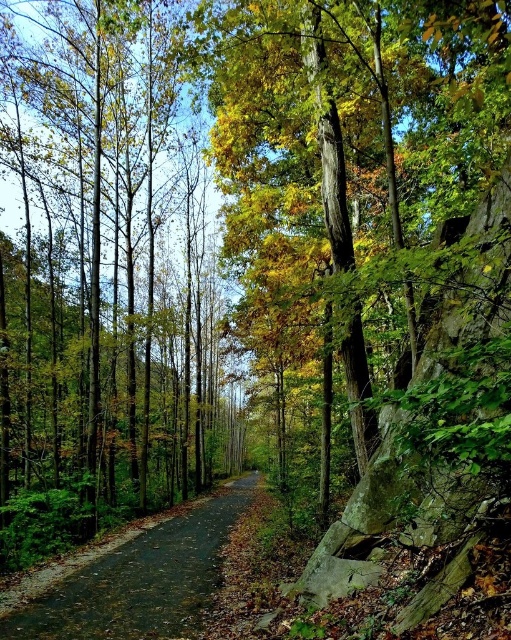
Question: Among these objects, which one is nearest to the camera?

Choices:
 (A) brown smooth tree at center
 (B) dark asphalt road at center

Answer: (B)

Question: Which of the following is the closest to the observer?

Choices:
 (A) (131, 561)
 (B) (86, 200)

Answer: (A)

Question: Is brown smooth tree at center smaller than dark asphalt road at center?

Choices:
 (A) yes
 (B) no

Answer: (B)

Question: Considering the relative positions of brown smooth tree at center and dark asphalt road at center in the image provided, where is brown smooth tree at center located with respect to dark asphalt road at center?

Choices:
 (A) left
 (B) right

Answer: (A)

Question: Is brown smooth tree at center thinner than dark asphalt road at center?

Choices:
 (A) no
 (B) yes

Answer: (A)